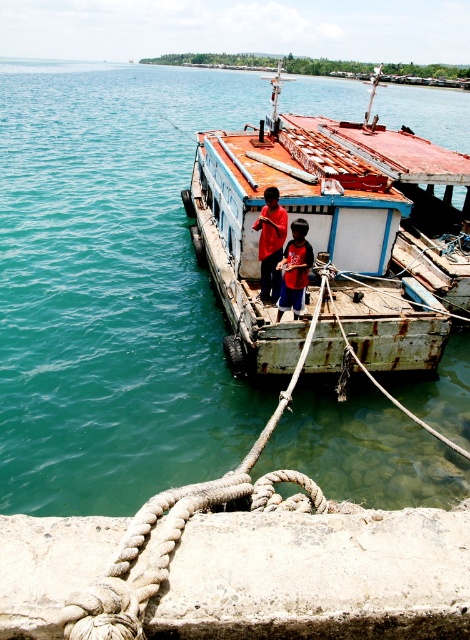
You are on the deck of the boat and need to retrieve the rope at center to secure the boat. Where should you move relative to the red cotton shirt at center to reach the rope?

The rope at center is to the left of the red cotton shirt at center, so you should move to the left side of the red cotton shirt at center to reach the rope.

You are standing on the pier next to the boat. You want to throw a small object into the teal water at center. Can you reach it from where you are standing?

The teal water at center is 8.43 meters away from the viewer. Since the average throwing distance for a small object is around 10 meters, you might be able to reach it but it would require a strong throw.